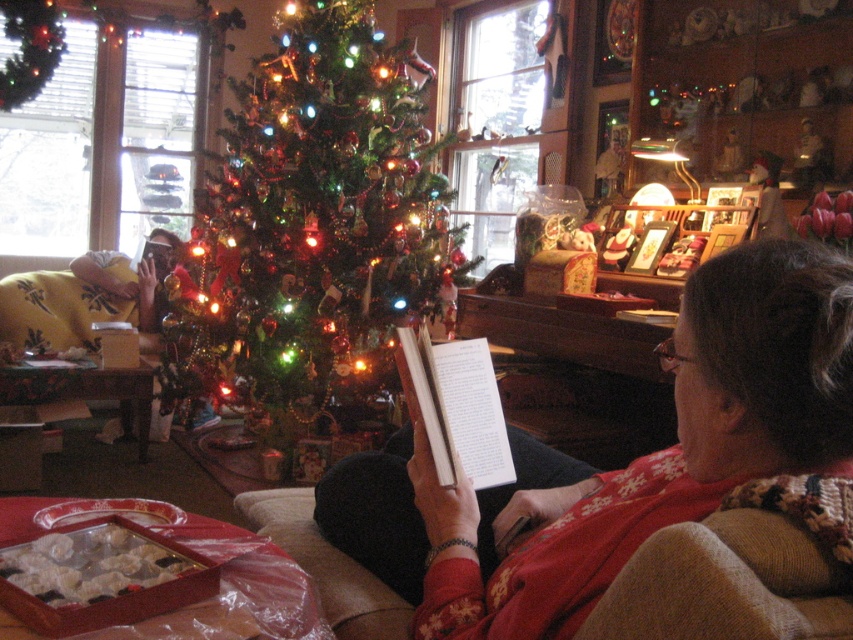
Question: Which of the following is the closest to the observer?

Choices:
 (A) shiny green christmas tree at center
 (B) red sweater at center

Answer: (B)

Question: Estimate the real-world distances between objects in this image. Which object is farther from the white paper book at center?

Choices:
 (A) shiny green christmas tree at center
 (B) red sweater at center

Answer: (A)

Question: Which point is closer to the camera?

Choices:
 (A) (454, 465)
 (B) (814, 460)
 (C) (285, 170)

Answer: (B)

Question: Does shiny green christmas tree at center appear on the right side of white paper book at center?

Choices:
 (A) yes
 (B) no

Answer: (B)

Question: Does shiny green christmas tree at center have a greater width compared to white paper book at center?

Choices:
 (A) yes
 (B) no

Answer: (A)

Question: Can you confirm if red sweater at center is positioned above shiny green christmas tree at center?

Choices:
 (A) yes
 (B) no

Answer: (B)